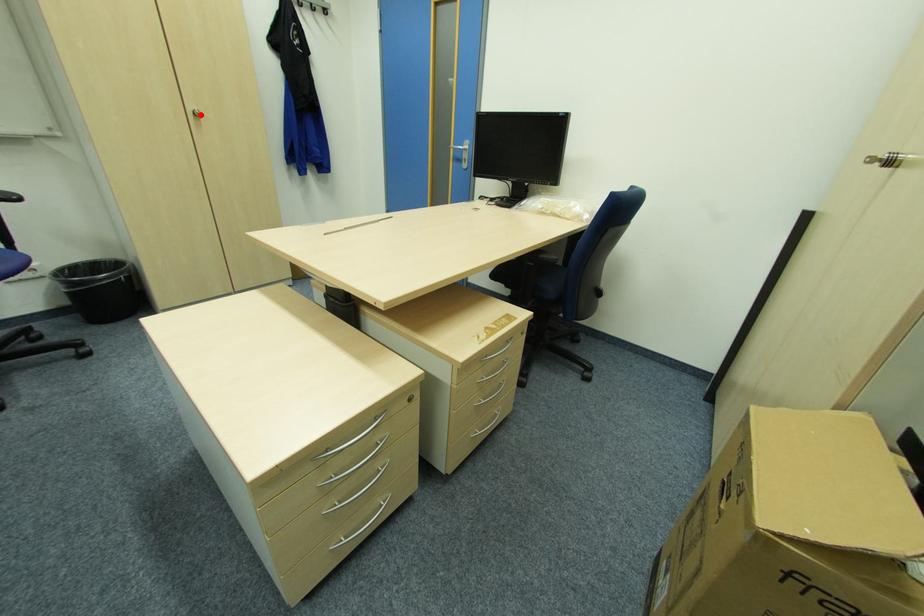
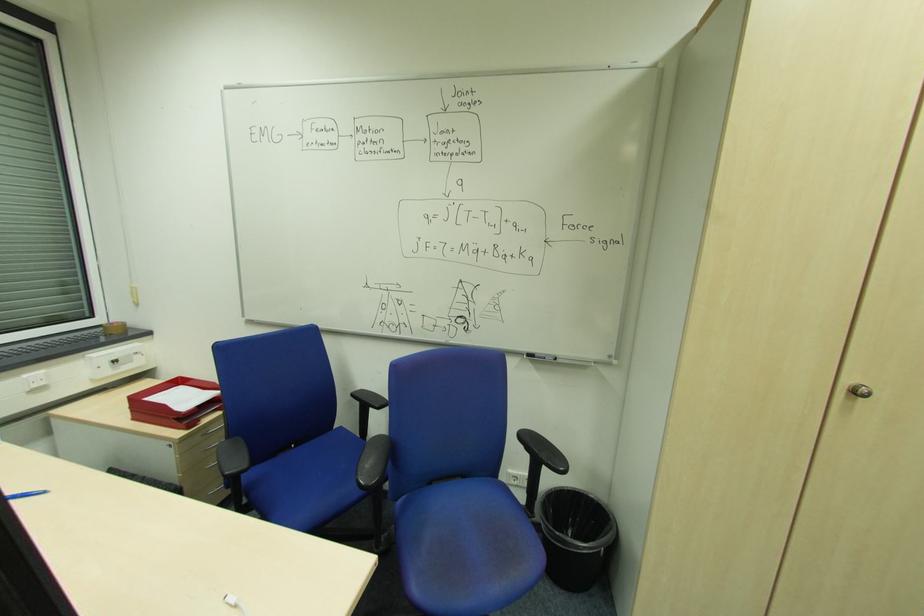
Locate, in the second image, the point that corresponds to the highlighted location in the first image.

(860, 392)